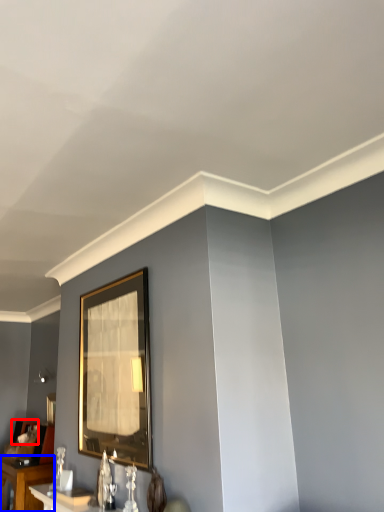
Question: Which of the following is the closest to the observer, picture frame (highlighted by a red box) or table (highlighted by a blue box)?

Choices:
 (A) picture frame
 (B) table

Answer: (B)